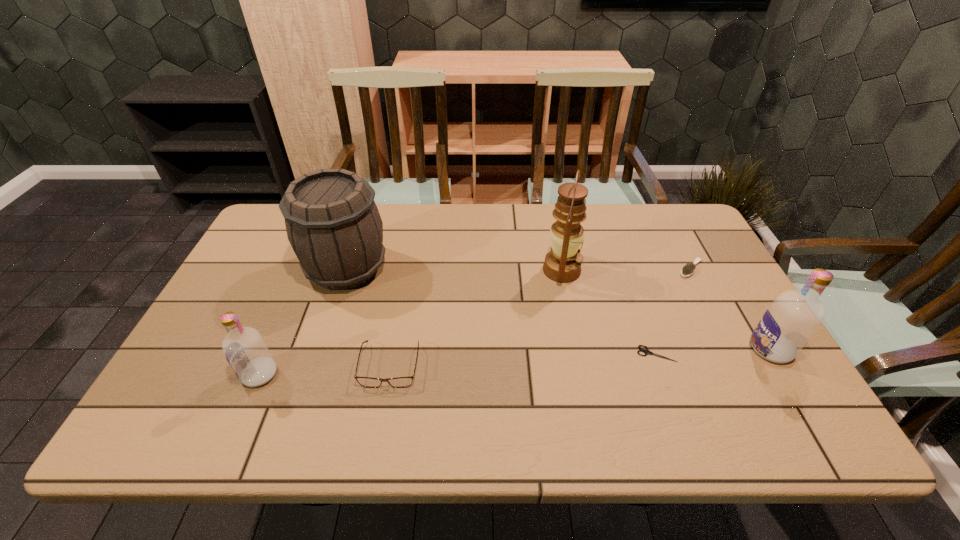
Locate an element on the screen. This screenshot has height=540, width=960. the fourth tallest object is located at coordinates (245, 350).

Find the location of a particular element. the shorter vodka is located at coordinates (245, 350).

The image size is (960, 540). Find the location of `the right vodka`. the right vodka is located at coordinates (794, 316).

This screenshot has width=960, height=540. Find the location of `wine bucket`. wine bucket is located at coordinates (333, 224).

Where is `the second shortest object`? the second shortest object is located at coordinates (688, 269).

At what (x,y) coordinates should I click in order to perform the action: click on the fourth object from left to right. Please return your answer as a coordinate pair (x, y). Looking at the image, I should click on (562, 264).

In order to click on the shortest object in this screenshot , I will do `click(647, 352)`.

Identify the location of shears. (647, 352).

Locate an element on the screen. spectacles is located at coordinates (400, 382).

Locate an element on the screen. This screenshot has height=540, width=960. vacant region located 0.050m on the label of the left vodka is located at coordinates (221, 374).